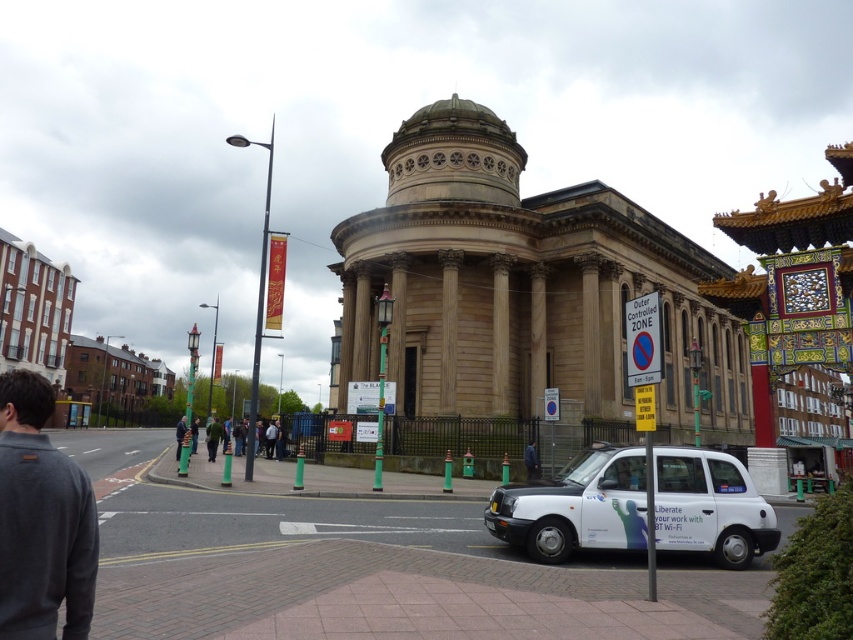
Who is higher up, dark gray fleece at lower left or dark blue jacket at center?

Positioned higher is dark gray fleece at lower left.

Does dark gray fleece at lower left come in front of dark blue jacket at center?

That is True.

Which is in front, point (62, 598) or point (177, 440)?

Point (62, 598) is more forward.

Identify the location of dark gray fleece at lower left. 41,518.

Does blue fabric jacket at center appear under green painted metal pole at center?

No.

Can you confirm if blue fabric jacket at center is bigger than green painted metal pole at center?

Actually, blue fabric jacket at center might be smaller than green painted metal pole at center.

You are a GUI agent. You are given a task and a screenshot of the screen. Output one action in this format:
    pyautogui.click(x=<x>, y=<y>)
    Task: Click on the blue fabric jacket at center
    Image resolution: width=853 pixels, height=640 pixels.
    Given the screenshot: What is the action you would take?
    pyautogui.click(x=531, y=460)

Find the location of a particular element. The height and width of the screenshot is (640, 853). blue fabric jacket at center is located at coordinates (531, 460).

Who is higher up, white matte taxi at lower right or dark gray fleece at lower left?

dark gray fleece at lower left

Who is lower down, white matte taxi at lower right or dark gray fleece at lower left?

white matte taxi at lower right is below.

Image resolution: width=853 pixels, height=640 pixels. In order to click on white matte taxi at lower right in this screenshot , I will do `click(575, 506)`.